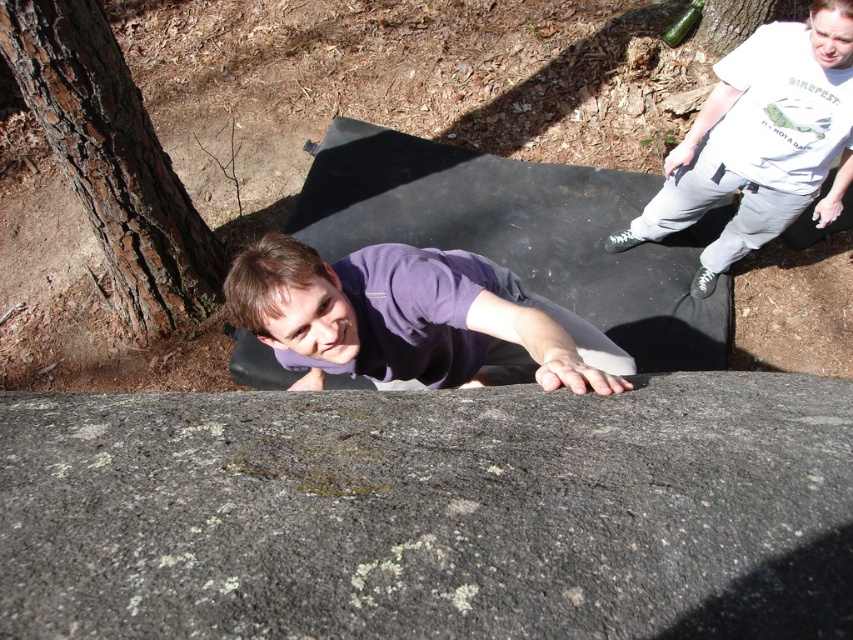
You are a photographer trying to capture a photo of the purple matte shirt at center and the brown rough bark at left. Since you want to ensure both are in focus, you need to know which object is closer to the camera. Can you determine which one is closer?

The purple matte shirt at center has a lesser height compared to brown rough bark at left, so the purple matte shirt at center is closer to the camera.

You are a photographer trying to capture both the purple matte shirt at center and the brown rough bark at left in the same frame. Based on their sizes in the image, which object should you focus on first to ensure both are in the frame?

The purple matte shirt at center occupies less space than brown rough bark at left, so you should focus on the brown rough bark at left first to ensure both are in the frame.

You are standing at the point marked by coordinates point (112, 160) in the image. What object is located at that point?

The point (112, 160) indicates brown rough bark at left.